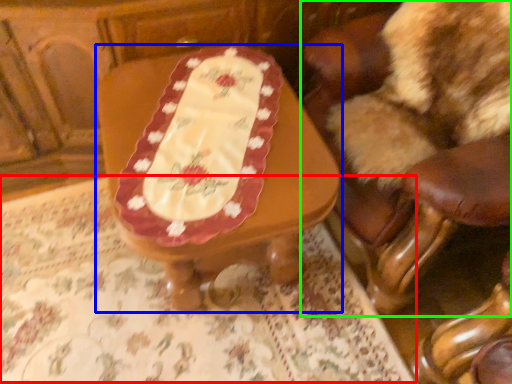
Question: Which object is positioned farthest from tablecloth (highlighted by a red box)? Select from table (highlighted by a blue box) and chair (highlighted by a green box).

Choices:
 (A) table
 (B) chair

Answer: (B)